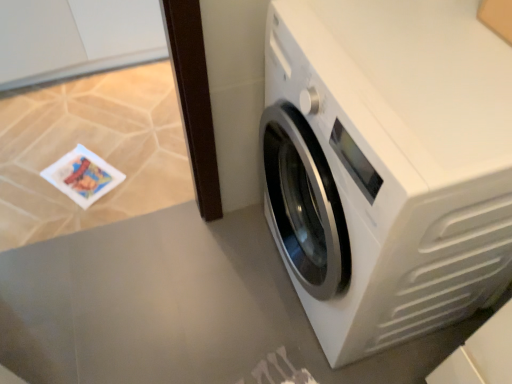
Question: Considering the relative positions of white glossy washing machine at right and white glossy table top at lower right in the image provided, is white glossy washing machine at right to the left or to the right of white glossy table top at lower right?

Choices:
 (A) left
 (B) right

Answer: (B)

Question: Is white glossy washing machine at right in front of or behind white glossy table top at lower right in the image?

Choices:
 (A) behind
 (B) front

Answer: (B)

Question: Looking at their shapes, would you say white glossy washing machine at right is wider or thinner than white glossy table top at lower right?

Choices:
 (A) thin
 (B) wide

Answer: (A)

Question: Is white glossy table top at lower right inside the boundaries of white glossy washing machine at right, or outside?

Choices:
 (A) inside
 (B) outside

Answer: (B)

Question: Looking at their shapes, would you say white glossy table top at lower right is wider or thinner than white glossy washing machine at right?

Choices:
 (A) thin
 (B) wide

Answer: (B)

Question: Would you say white glossy table top at lower right is to the left or to the right of white glossy washing machine at right in the picture?

Choices:
 (A) left
 (B) right

Answer: (A)

Question: Based on their sizes in the image, would you say white glossy table top at lower right is bigger or smaller than white glossy washing machine at right?

Choices:
 (A) small
 (B) big

Answer: (A)